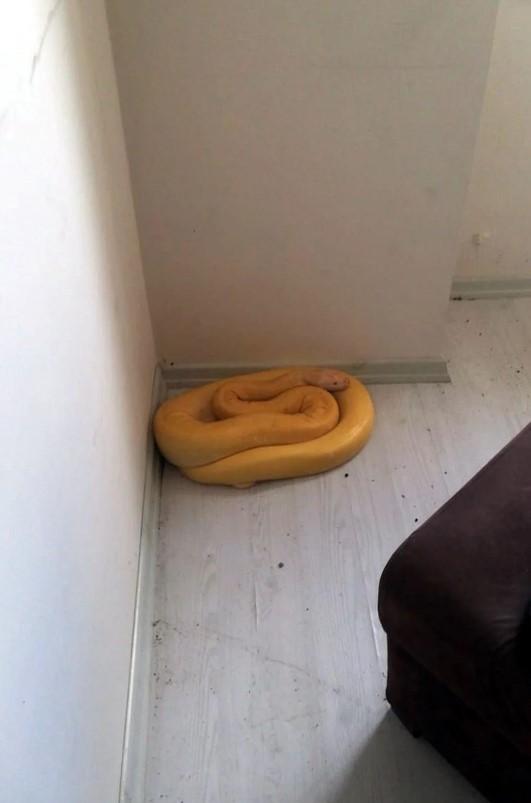
Locate an element on the screen. Image resolution: width=531 pixels, height=803 pixels. wall is located at coordinates (82, 420).